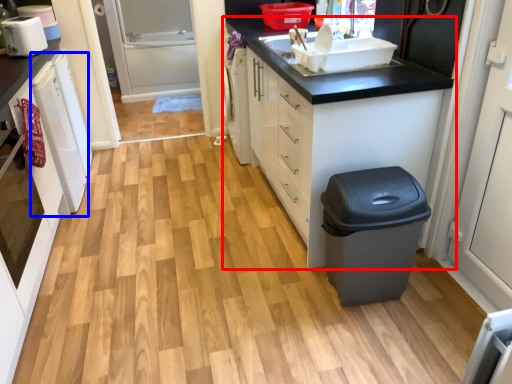
Question: Among these objects, which one is farthest to the camera, cabinetry (highlighted by a red box) or dish washer (highlighted by a blue box)?

Choices:
 (A) cabinetry
 (B) dish washer

Answer: (B)